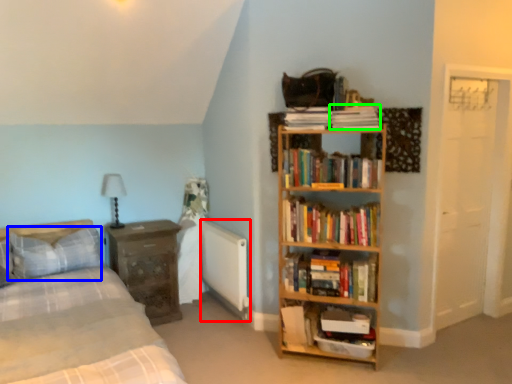
Question: Which object is positioned farthest from radiator (highlighted by a red box)? Select from pillow (highlighted by a blue box) and paperback book (highlighted by a green box).

Choices:
 (A) pillow
 (B) paperback book

Answer: (B)